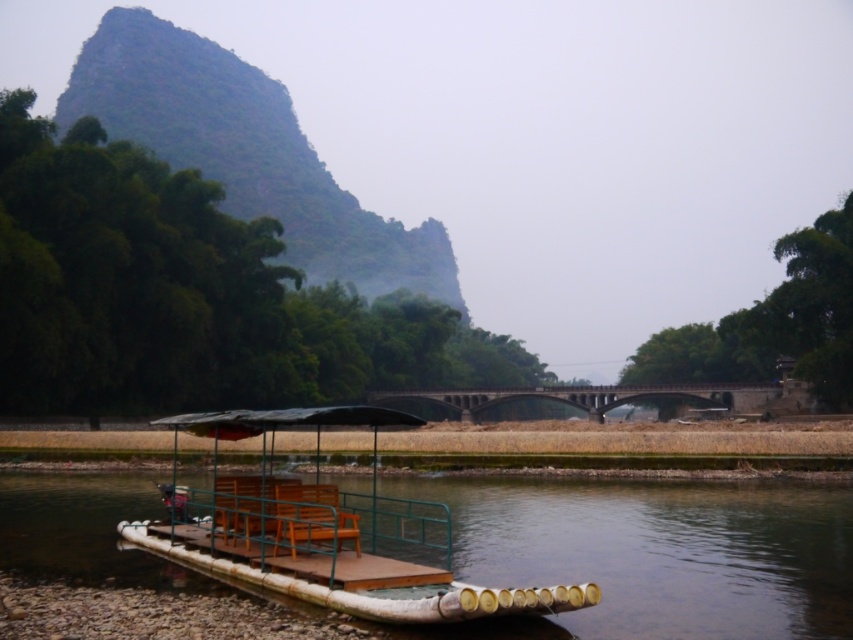
Question: Does brown wooden raft at lower center appear under wooden raft at lower center?

Choices:
 (A) yes
 (B) no

Answer: (A)

Question: Considering the relative positions of brown wooden raft at lower center and wooden raft at lower center in the image provided, where is brown wooden raft at lower center located with respect to wooden raft at lower center?

Choices:
 (A) below
 (B) above

Answer: (A)

Question: Which point is farther from the camera taking this photo?

Choices:
 (A) (51, 500)
 (B) (526, 589)

Answer: (A)

Question: From the image, what is the correct spatial relationship of brown wooden raft at lower center in relation to wooden raft at lower center?

Choices:
 (A) below
 (B) above

Answer: (A)

Question: Which point is closer to the camera?

Choices:
 (A) wooden raft at lower center
 (B) brown wooden raft at lower center

Answer: (A)

Question: Which of the following is the farthest from the observer?

Choices:
 (A) coord(683,605)
 (B) coord(175,426)

Answer: (B)